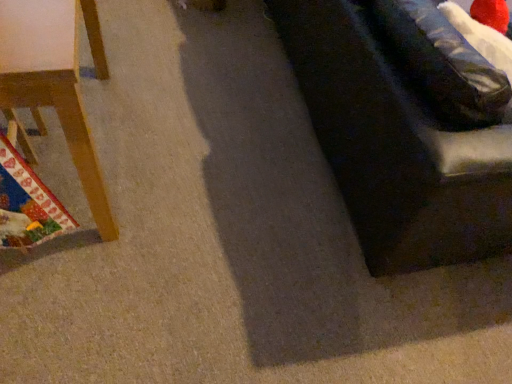
Question: In the image, is wooden chair at left positioned in front of or behind dark fabric couch at right?

Choices:
 (A) behind
 (B) front

Answer: (B)

Question: Is wooden chair at left taller or shorter than dark fabric couch at right?

Choices:
 (A) short
 (B) tall

Answer: (A)

Question: Is wooden chair at left to the left or to the right of dark fabric couch at right in the image?

Choices:
 (A) right
 (B) left

Answer: (B)

Question: Is dark fabric couch at right to the left or to the right of wooden chair at left in the image?

Choices:
 (A) left
 (B) right

Answer: (B)

Question: In terms of width, does dark fabric couch at right look wider or thinner when compared to wooden chair at left?

Choices:
 (A) thin
 (B) wide

Answer: (B)

Question: Relative to wooden chair at left, is dark fabric couch at right in front or behind?

Choices:
 (A) behind
 (B) front

Answer: (A)

Question: Does point (346, 165) appear closer or farther from the camera than point (39, 59)?

Choices:
 (A) closer
 (B) farther

Answer: (B)